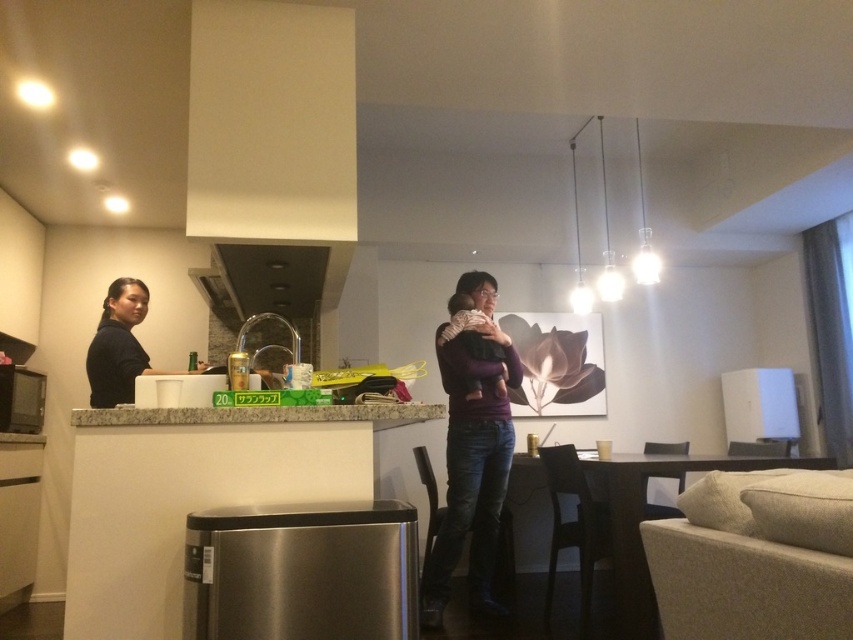
Does dark purple sweater at center appear on the right side of black matte shirt at upper left?

Correct, you'll find dark purple sweater at center to the right of black matte shirt at upper left.

The height and width of the screenshot is (640, 853). Describe the element at coordinates (471, 470) in the screenshot. I see `dark purple sweater at center` at that location.

Is point (500, 460) in front of point (122, 358)?

No, it is behind (122, 358).

I want to click on dark purple sweater at center, so click(x=471, y=470).

Does point (492, 611) lie behind point (292, 259)?

Yes, point (492, 611) is behind point (292, 259).

Who is more distant from viewer, (x=473, y=355) or (x=222, y=296)?

The point (x=222, y=296) is more distant.

Find the location of a particular element. The width and height of the screenshot is (853, 640). dark purple sweater at center is located at coordinates (471, 470).

Measure the distance between granite countertop at center and camera.

granite countertop at center is 1.74 meters from camera.

Locate an element on the screen. The height and width of the screenshot is (640, 853). granite countertop at center is located at coordinates (259, 413).

The width and height of the screenshot is (853, 640). I want to click on granite countertop at center, so pos(259,413).